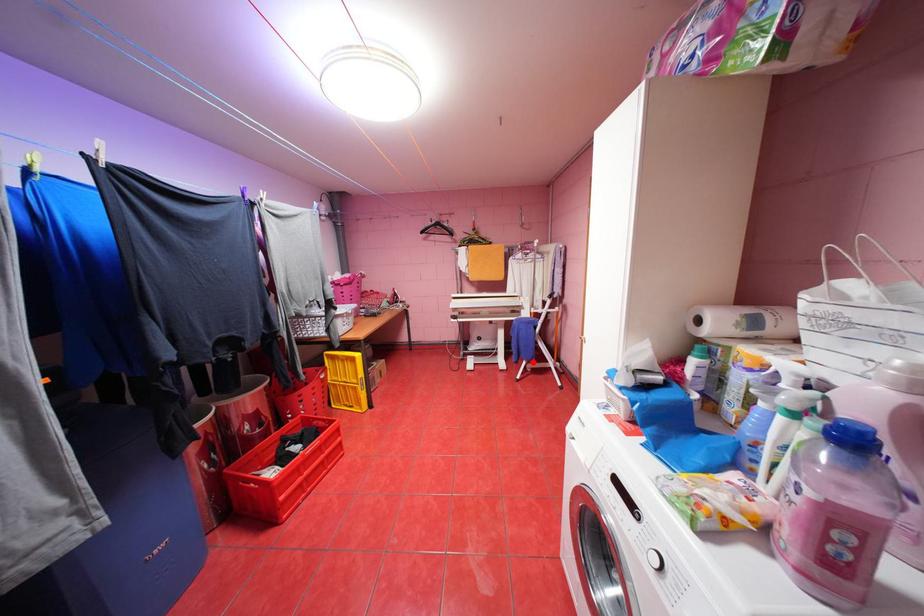
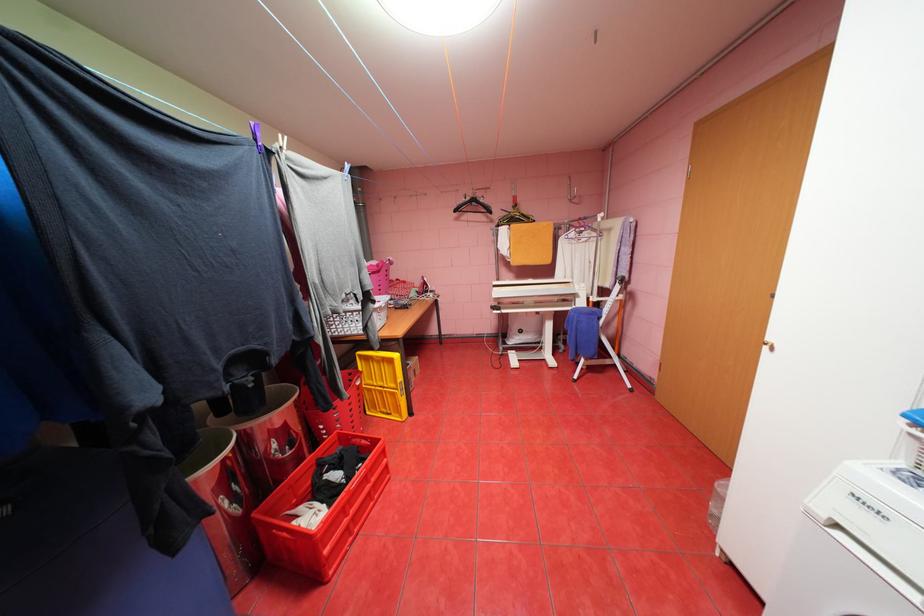
Question: I am providing you with two images of the same scene from different viewpoints. Given a red point in image1, look at the same physical point in image2. Is it:

Choices:
 (A) Closer to the viewpoint
 (B) Farther from the viewpoint

Answer: (A)